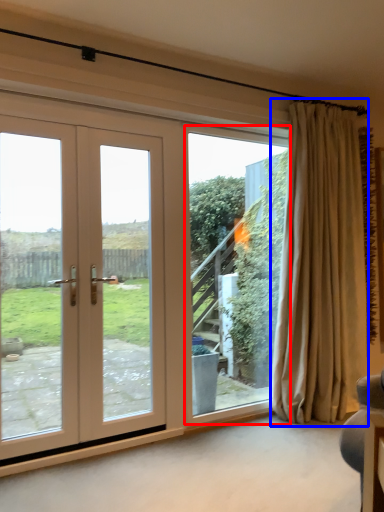
Question: Which of the following is the farthest to the observer, window screen (highlighted by a red box) or curtain (highlighted by a blue box)?

Choices:
 (A) window screen
 (B) curtain

Answer: (A)